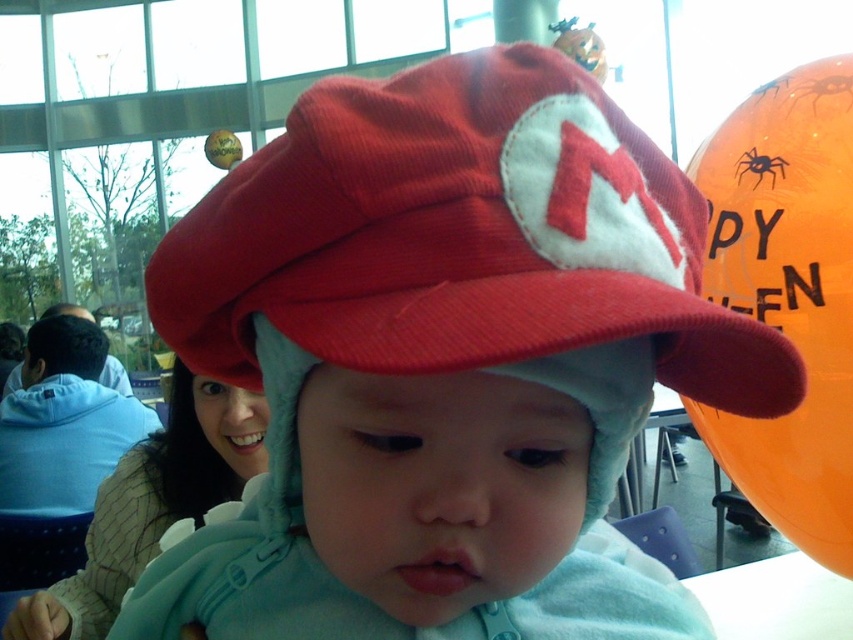
Does orange glossy balloon at upper right come behind black matte spider at upper right?

That is False.

Can you confirm if orange glossy balloon at upper right is positioned to the right of black matte spider at upper right?

Incorrect, orange glossy balloon at upper right is not on the right side of black matte spider at upper right.

Who is more distant from viewer, [831,253] or [740,164]?

The point [740,164] is more distant.

Where is `orange glossy balloon at upper right`? orange glossy balloon at upper right is located at coordinates (788, 298).

Can you confirm if red corduroy hat at center is positioned to the left of black matte spider at upper right?

Indeed, red corduroy hat at center is positioned on the left side of black matte spider at upper right.

Who is more forward, (602, 300) or (770, 186)?

Point (602, 300) is more forward.

Where is `red corduroy hat at center`? red corduroy hat at center is located at coordinates pos(460,237).

Which is more to the left, red corduroy hat at center or orange glossy balloon at upper right?

red corduroy hat at center

Which is behind, point (555, 76) or point (828, 305)?

Point (828, 305)

Locate an element on the screen. The height and width of the screenshot is (640, 853). red corduroy hat at center is located at coordinates (460, 237).